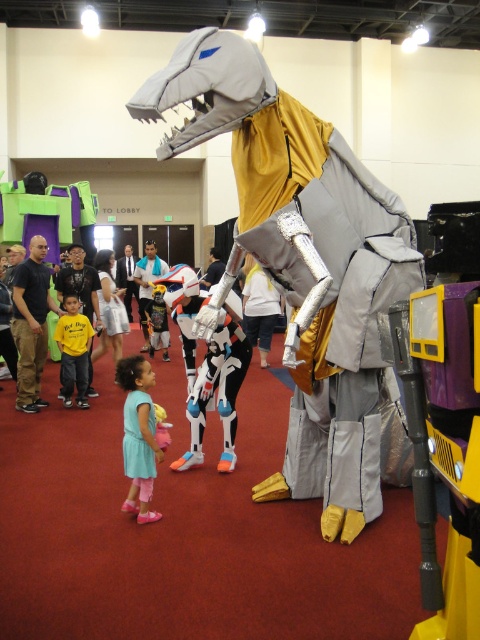
Question: Among these objects, which one is farthest from the camera?

Choices:
 (A) white and black costume at center
 (B) white matte shirt at center

Answer: (A)

Question: Which object appears closest to the camera in this image?

Choices:
 (A) plush yellow costume at center
 (B) white and black costume at center
 (C) white matte shirt at center

Answer: (C)

Question: Is yellow matte shirt at center closer to the viewer compared to plush yellow costume at center?

Choices:
 (A) no
 (B) yes

Answer: (B)

Question: Observing the image, what is the correct spatial positioning of yellow matte shirt at center in reference to metallic silver dress at center?

Choices:
 (A) above
 (B) below

Answer: (B)

Question: Considering the relative positions of white matte shirt at center and plush yellow costume at center in the image provided, where is white matte shirt at center located with respect to plush yellow costume at center?

Choices:
 (A) left
 (B) right

Answer: (B)

Question: Which of the following is the farthest from the observer?

Choices:
 (A) white and black costume at center
 (B) plush yellow costume at center

Answer: (A)